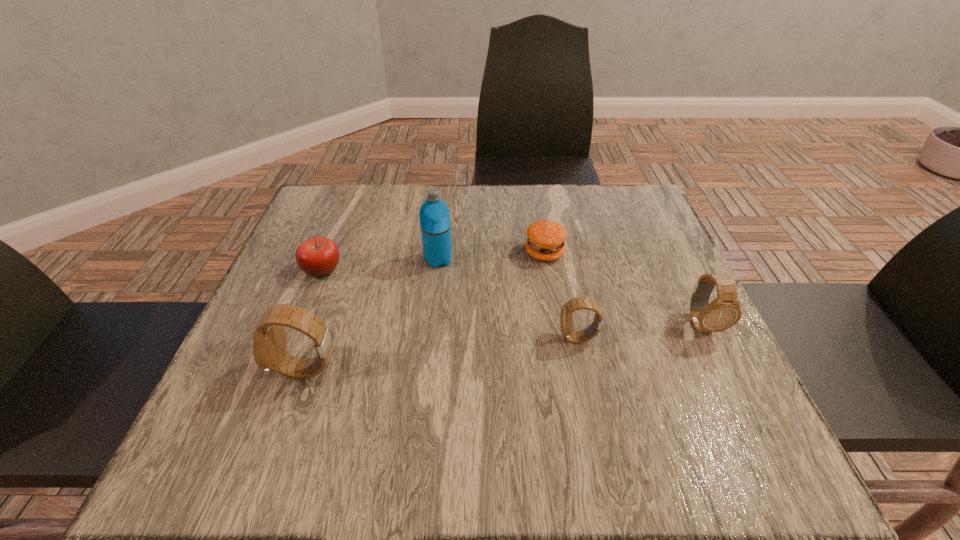
At what (x,y) coordinates should I click in order to perform the action: click on the nearest watch. Please return your answer as a coordinate pair (x, y). The image size is (960, 540). Looking at the image, I should click on (269, 341).

This screenshot has width=960, height=540. What are the coordinates of `the nearest object` in the screenshot? It's located at (269, 341).

Find the location of a particular element. This screenshot has height=540, width=960. the second watch from left to right is located at coordinates (566, 318).

Locate an element on the screen. The image size is (960, 540). the rightmost object is located at coordinates (724, 312).

Locate an element on the screen. the second shortest watch is located at coordinates (724, 312).

The height and width of the screenshot is (540, 960). In order to click on patty in this screenshot , I will do `click(546, 238)`.

This screenshot has width=960, height=540. In order to click on apple in this screenshot , I will do `click(318, 256)`.

I want to click on the tallest object, so click(435, 224).

At what (x,y) coordinates should I click in order to perform the action: click on thermos bottle. Please return your answer as a coordinate pair (x, y). Looking at the image, I should click on (435, 224).

The height and width of the screenshot is (540, 960). Identify the location of vacant space located 0.060m on the face of the nearest watch. pos(246,370).